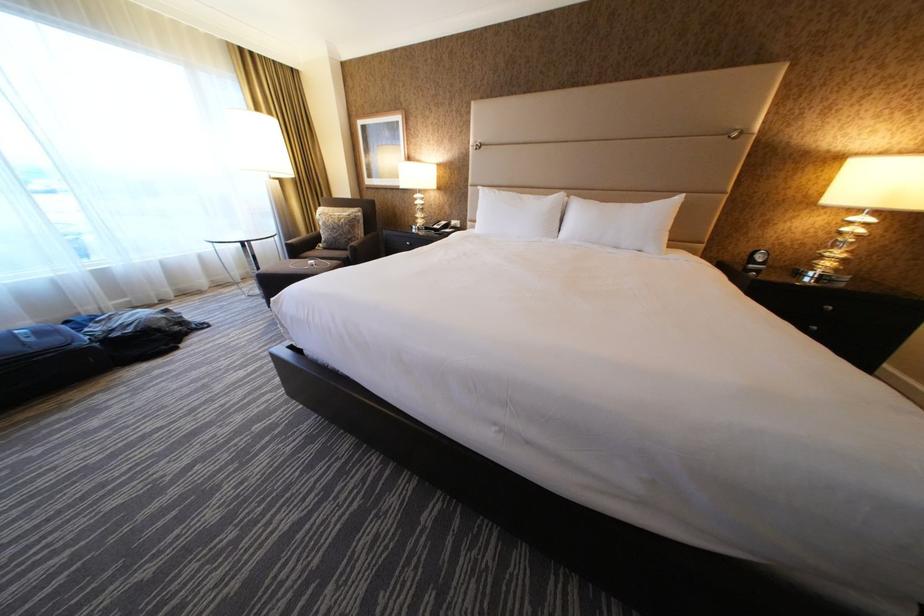
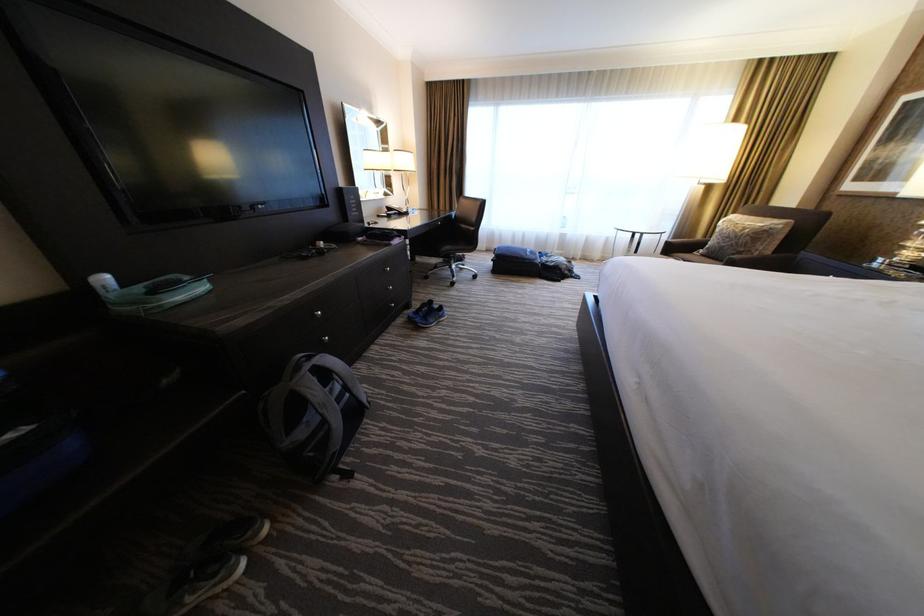
The images are taken continuously from a first-person perspective. In which direction is your viewpoint rotating?

The camera rotated toward left-down.